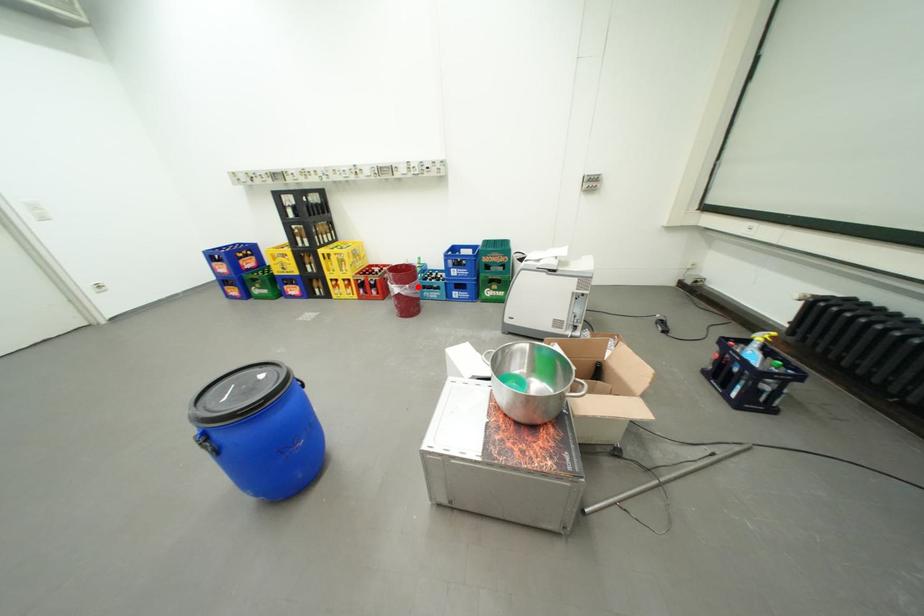
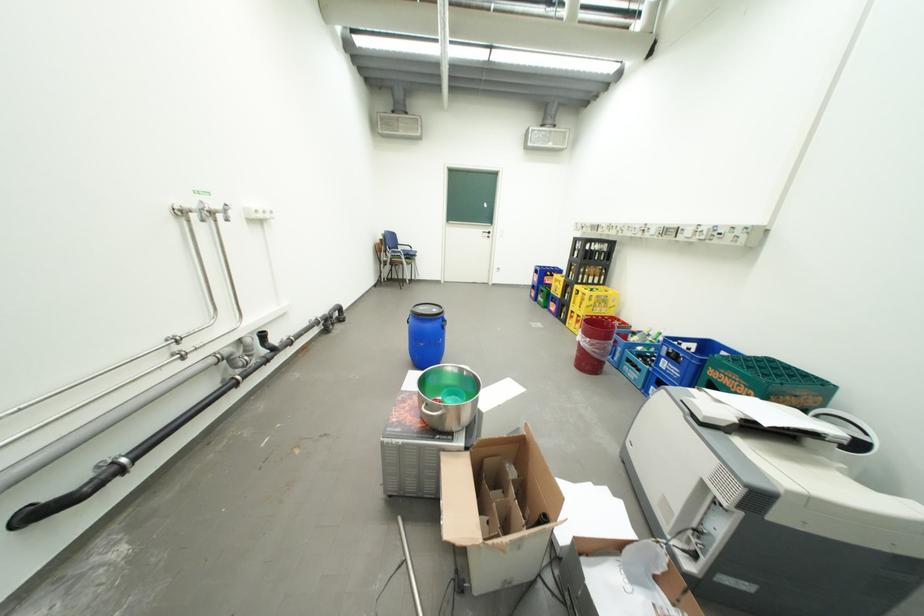
Question: I am providing you with two images of the same scene from different viewpoints. A red point is shown in image1. For the corresponding object point in image2, is it positioned nearer or farther from the camera?

Choices:
 (A) Nearer
 (B) Farther

Answer: (A)